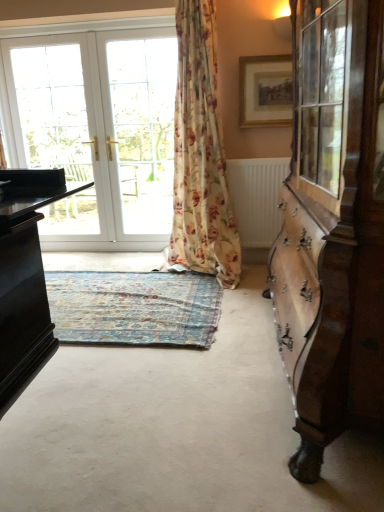
Question: From the image's perspective, is blue floral rug at center above or below white textured radiator at center?

Choices:
 (A) below
 (B) above

Answer: (A)

Question: Based on their sizes in the image, would you say blue floral rug at center is bigger or smaller than white textured radiator at center?

Choices:
 (A) small
 (B) big

Answer: (B)

Question: Considering the real-world distances, which object is farthest from the white textured radiator at center?

Choices:
 (A) blue floral rug at center
 (B) mahogany wood cabinet at right
 (C) floral fabric curtain at center
 (D) gold-framed picture at upper center
 (E) white glossy door at upper left

Answer: (B)

Question: Based on their relative distances, which object is nearer to the mahogany wood cabinet at right?

Choices:
 (A) gold-framed picture at upper center
 (B) white glass door at center
 (C) floral fabric curtain at center
 (D) white textured radiator at center
 (E) blue floral rug at center

Answer: (E)